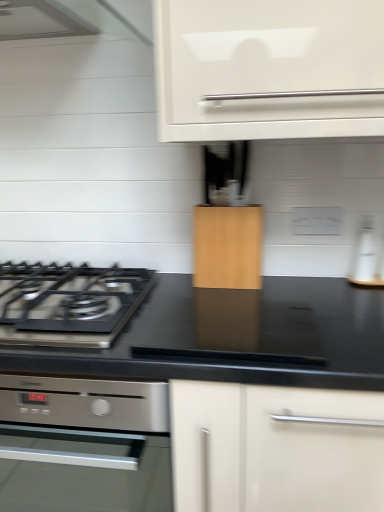
Question: Considering the relative sizes of white glossy bottle at right and satin silver oven at lower left in the image provided, is white glossy bottle at right shorter than satin silver oven at lower left?

Choices:
 (A) no
 (B) yes

Answer: (B)

Question: Can satin silver oven at lower left be found inside white glossy bottle at right?

Choices:
 (A) no
 (B) yes

Answer: (A)

Question: Can you confirm if white glossy bottle at right is smaller than satin silver oven at lower left?

Choices:
 (A) yes
 (B) no

Answer: (A)

Question: Does white glossy bottle at right have a greater width compared to satin silver oven at lower left?

Choices:
 (A) yes
 (B) no

Answer: (B)

Question: Is white glossy bottle at right to the right of satin silver oven at lower left from the viewer's perspective?

Choices:
 (A) no
 (B) yes

Answer: (B)

Question: From the image's perspective, does white glossy bottle at right appear lower than satin silver oven at lower left?

Choices:
 (A) yes
 (B) no

Answer: (B)

Question: Can black matte gas stove at left be found inside wooden cabinet at center?

Choices:
 (A) yes
 (B) no

Answer: (B)

Question: Is wooden cabinet at center positioned with its back to black matte gas stove at left?

Choices:
 (A) yes
 (B) no

Answer: (B)

Question: Does wooden cabinet at center have a greater height compared to black matte gas stove at left?

Choices:
 (A) yes
 (B) no

Answer: (A)

Question: Considering the relative sizes of wooden cabinet at center and black matte gas stove at left in the image provided, is wooden cabinet at center shorter than black matte gas stove at left?

Choices:
 (A) no
 (B) yes

Answer: (A)

Question: Does wooden cabinet at center appear on the right side of black matte gas stove at left?

Choices:
 (A) no
 (B) yes

Answer: (B)

Question: Is wooden cabinet at center wider than black matte gas stove at left?

Choices:
 (A) no
 (B) yes

Answer: (A)

Question: Does wooden cabinet at center have a larger size compared to white glossy bottle at right?

Choices:
 (A) no
 (B) yes

Answer: (B)